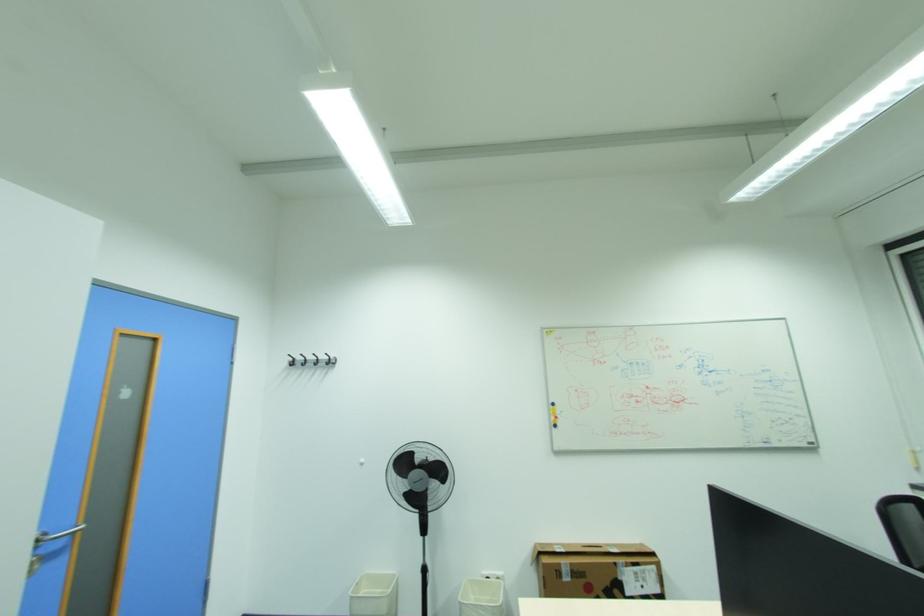
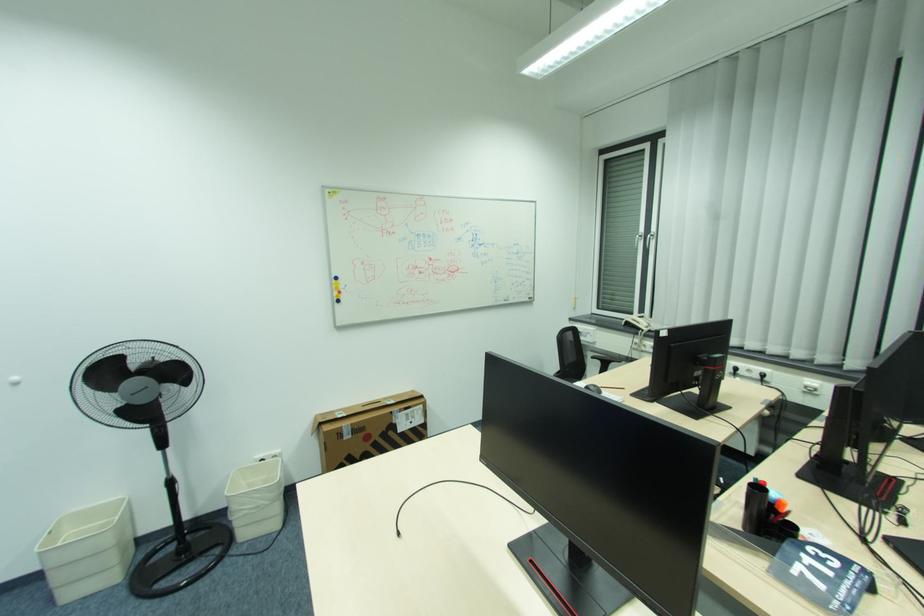
Find the pixel in the second image that matches (x=398, y=576) in the first image.

(128, 500)